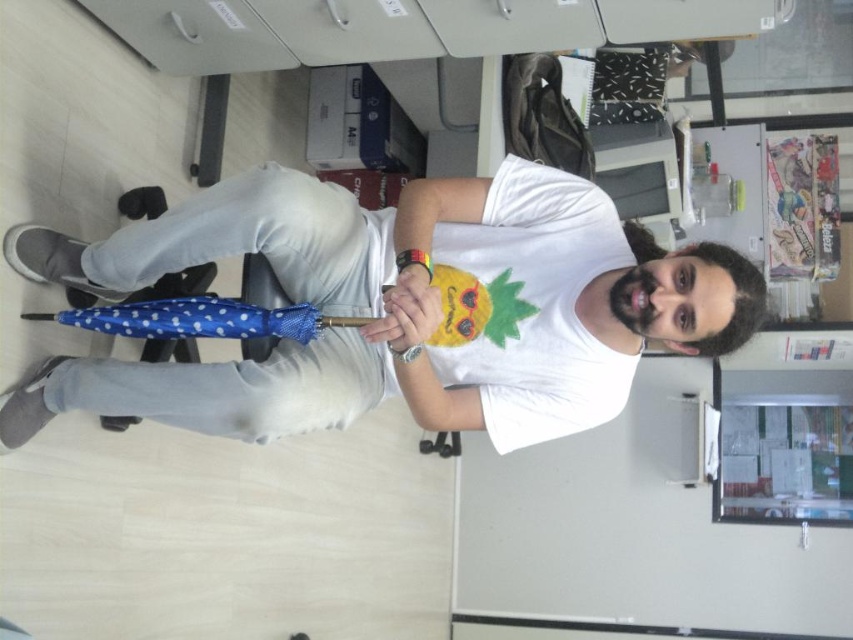
You are organizing a small event and need to place two blue polka dot umbrellas in the office. The blue polka dot umbrella at center and the blue polka dot umbrella at lower left must be positioned such that there is enough space between them for attendees to walk comfortably. Given that the minimum required distance for comfortable passage is 8 inches, can the current placement of these umbrellas meet this requirement?

The distance between the blue polka dot umbrella at center and the blue polka dot umbrella at lower left is 7.49 inches, which is less than the required 8 inches for comfortable passage. Therefore, the current placement does not meet the requirement.

You are organizing an office space and need to place two blue polka dot umbrellas. The blue polka dot umbrella at center and the blue polka dot umbrella at lower left are both in the way. Which one should you move first if you want to keep the wider one in its current position?

Result: The blue polka dot umbrella at center might be wider than the blue polka dot umbrella at lower left, so you should move the blue polka dot umbrella at lower left first to keep the wider one in place.

You are trying to determine the distance between two points in the image. The first point is labeled as point (515, 326) and the second is point (128, 316). Which point is closer to you?

Point (128, 316) is closer to you since it is less further than point (515, 326).